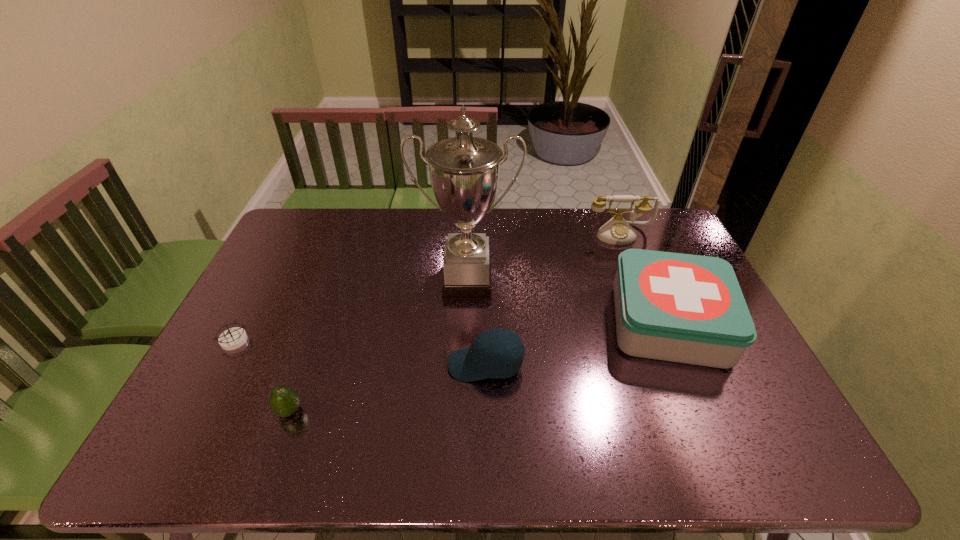
Locate an element on the screen. Image resolution: width=960 pixels, height=540 pixels. free space located on the left of the first-aid kit is located at coordinates (500, 322).

Find the location of a particular element. free space located on the front-facing side of the fourth tallest object is located at coordinates (357, 364).

Find the location of a particular element. This screenshot has width=960, height=540. vacant space situated on the front-facing side of the fourth tallest object is located at coordinates (372, 364).

I want to click on vacant region located on the front-facing side of the fourth tallest object, so click(414, 364).

I want to click on vacant region located 0.160m on the left of the nearest object, so click(209, 411).

Where is `vacant space located 0.220m on the right of the leftmost object`? This screenshot has width=960, height=540. vacant space located 0.220m on the right of the leftmost object is located at coordinates (325, 341).

I want to click on object at the far edge, so click(x=617, y=231).

The image size is (960, 540). Find the location of `object positioned at the left edge`. object positioned at the left edge is located at coordinates (233, 338).

Where is `telephone present at the right edge`? The image size is (960, 540). telephone present at the right edge is located at coordinates (617, 231).

The image size is (960, 540). I want to click on the first-aid kit that is at the right edge, so click(684, 308).